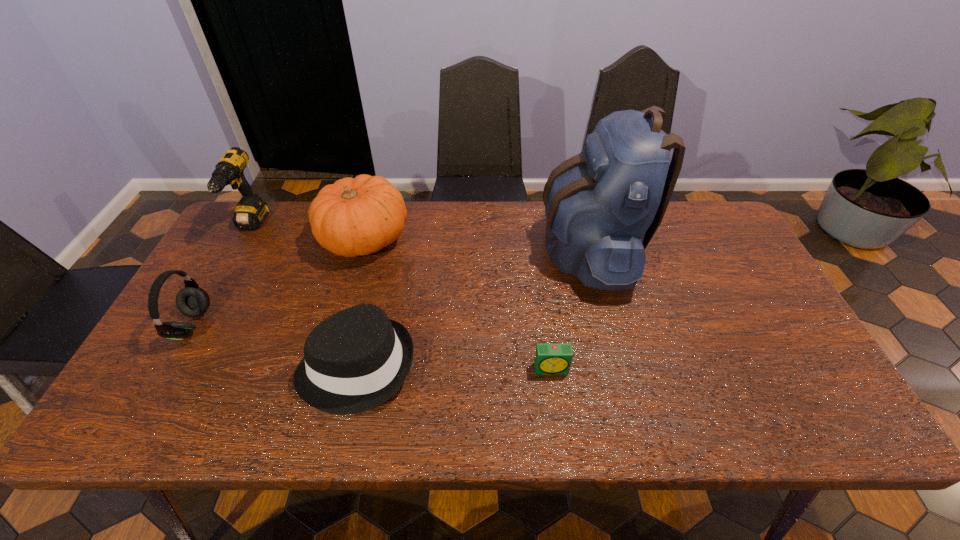
Find the location of a particular element. This screenshot has height=540, width=960. object that is at the far left corner is located at coordinates (250, 212).

The height and width of the screenshot is (540, 960). In order to click on free point at the far edge in this screenshot , I will do `click(528, 248)`.

Identify the location of vacant region at the near edge of the desktop. (585, 402).

This screenshot has height=540, width=960. In order to click on free spot at the left edge of the desktop in this screenshot , I will do `click(136, 392)`.

The width and height of the screenshot is (960, 540). In order to click on free space at the right edge of the desktop in this screenshot , I will do `click(706, 268)`.

Locate an element on the screen. This screenshot has height=540, width=960. vacant region at the far right corner of the desktop is located at coordinates (712, 233).

What are the coordinates of `vacant space that's between the tallest object and the alarm clock` in the screenshot? It's located at (570, 308).

The image size is (960, 540). I want to click on vacant area between the fedora and the pumpkin, so click(x=360, y=302).

Identify the location of vacant region between the alarm clock and the fedora. (454, 368).

Find the location of a particular element. This screenshot has width=960, height=540. unoccupied area between the fifth shortest object and the pumpkin is located at coordinates (307, 233).